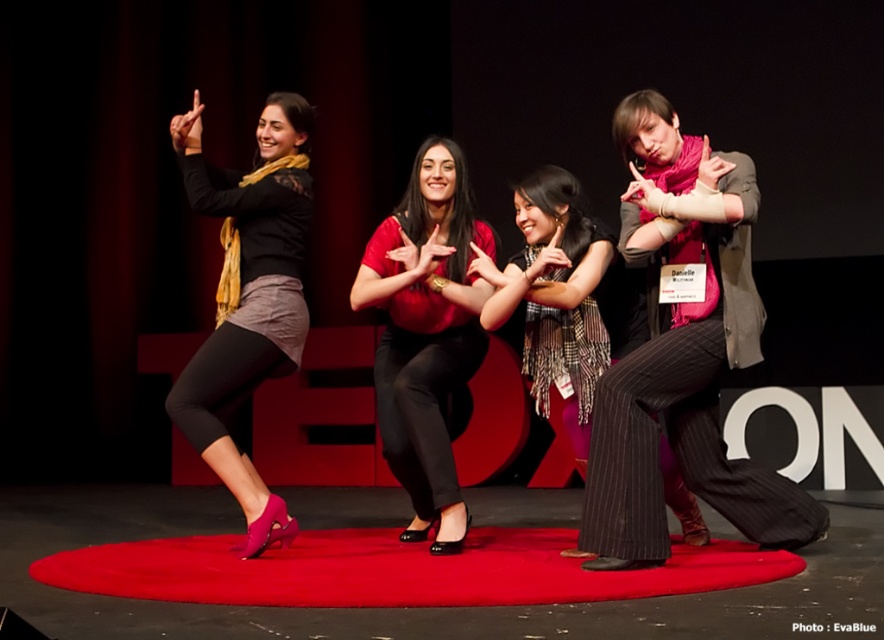
You are a photographer positioned at the edge of the stage. You need to capture a photo where the rubberized red carpet at center and the matte red blouse at center are both visible. Based on their positions, which object should appear to your left in the photo?

The rubberized red carpet at center is to the left of matte red blouse at center, so in the photo, the rubberized red carpet at center will appear to your left side.

You are a stagehand who needs to place a new spotlight on the stage. The spotlight can only illuminate objects to its right. If you position the spotlight to the left of the rubberized red carpet at center, will it illuminate the plaid scarf at center?

The rubberized red carpet at center is positioned on the left side of plaid scarf at center. Since the spotlight is placed to the left of the rubberized red carpet at center, the plaid scarf at center is to the right of the carpet. Therefore, the spotlight will illuminate the plaid scarf at center.

You are a stagehand standing at the center of the stage. You need to place a spotlight on the point closer to you between the point at coordinates point [404,572] and point [408,257]. Which coordinate should you choose?

You should choose the point at coordinates point [404,572] because it is closer to you than the other point.